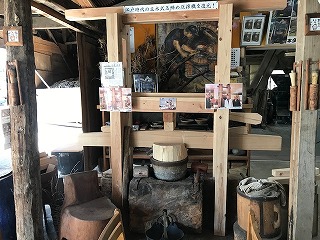
You are a GUI agent. You are given a task and a screenshot of the screen. Output one action in this format:
    pyautogui.click(x=<x>, y=<y>)
    Task: Click on the large painting
    The width and height of the screenshot is (320, 240).
    Given the screenshot: What is the action you would take?
    pyautogui.click(x=192, y=59)